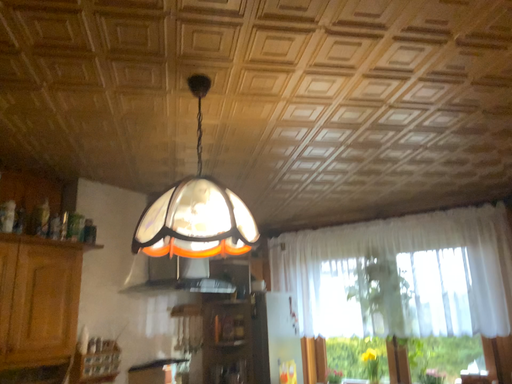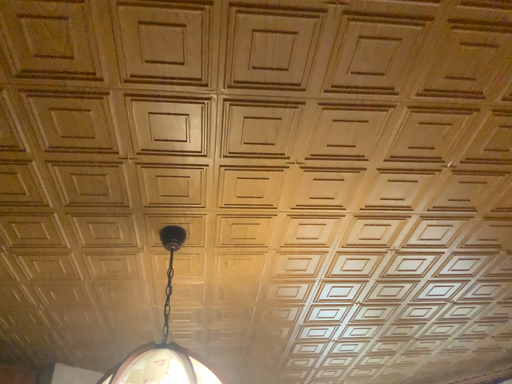
Question: Which way did the camera rotate in the video?

Choices:
 (A) rotated downward
 (B) rotated upward

Answer: (B)